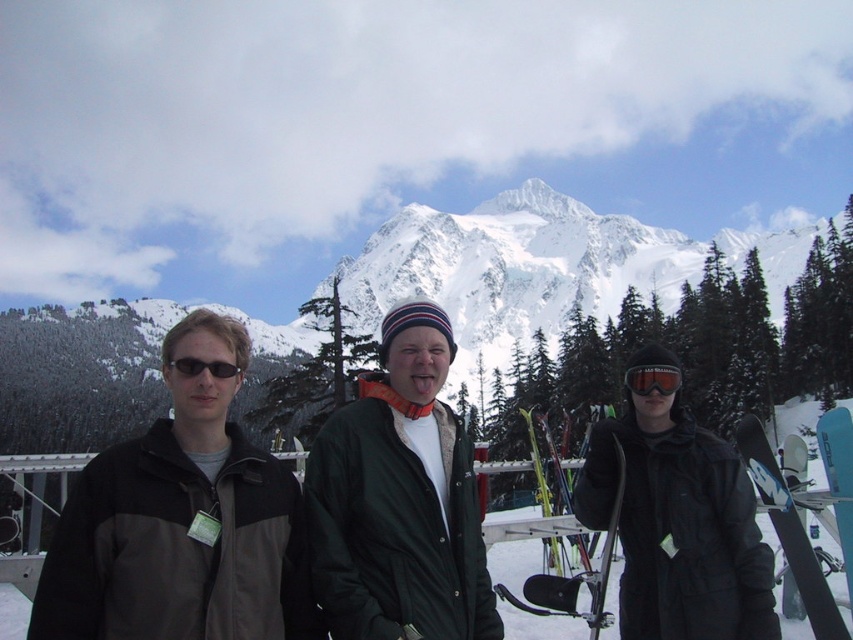
Question: Does dark gray jacket at center come behind dark gray jacket at left?

Choices:
 (A) yes
 (B) no

Answer: (A)

Question: Can you confirm if dark gray jacket at left is bigger than black matte jacket at center?

Choices:
 (A) yes
 (B) no

Answer: (A)

Question: Which is farther from the yellow metallic ski at center?

Choices:
 (A) black matte sunglasses at center
 (B) dark gray jacket at left

Answer: (A)

Question: Does dark gray jacket at left appear on the left side of yellow metallic ski at center?

Choices:
 (A) no
 (B) yes

Answer: (B)

Question: Considering the real-world distances, which object is farthest from the snowy mountain at center?

Choices:
 (A) black matte jacket at center
 (B) black matte sunglasses at center
 (C) dark gray jacket at left
 (D) yellow metallic ski at center

Answer: (B)

Question: Among these points, which one is nearest to the camera?

Choices:
 (A) (207, 616)
 (B) (601, 573)
 (C) (178, 369)

Answer: (A)